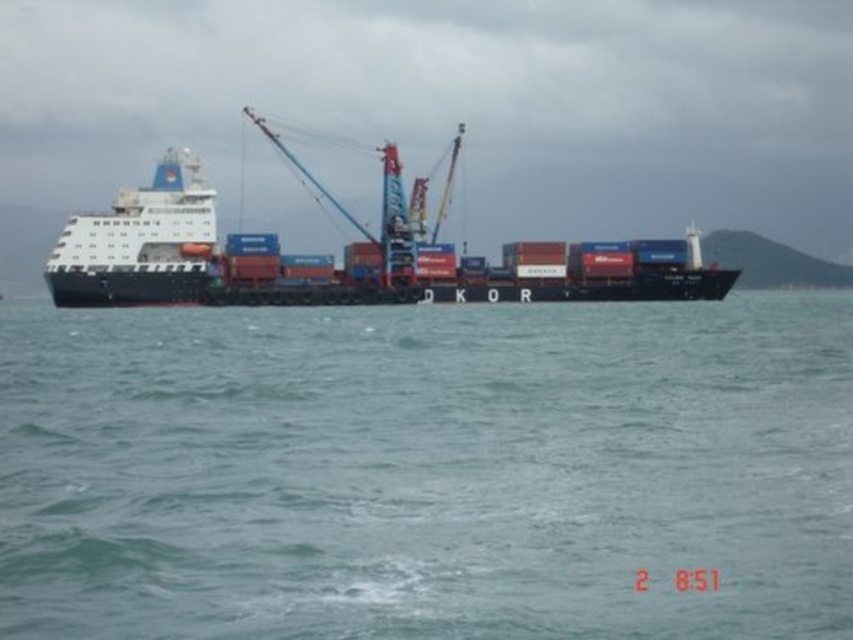
Question: Can you confirm if blue water at center is wider than black matte container ship at center?

Choices:
 (A) yes
 (B) no

Answer: (B)

Question: Which point is closer to the camera?

Choices:
 (A) blue water at center
 (B) black matte container ship at center
 (C) white glossy cruise ship at upper left

Answer: (A)

Question: Does black matte container ship at center have a larger size compared to white glossy cruise ship at upper left?

Choices:
 (A) yes
 (B) no

Answer: (A)

Question: Which object is closer to the camera taking this photo?

Choices:
 (A) white glossy cruise ship at upper left
 (B) blue water at center
 (C) black matte container ship at center

Answer: (B)

Question: Which object appears closest to the camera in this image?

Choices:
 (A) white glossy cruise ship at upper left
 (B) blue water at center
 (C) black matte container ship at center

Answer: (B)

Question: Does black matte container ship at center come behind white glossy cruise ship at upper left?

Choices:
 (A) no
 (B) yes

Answer: (B)